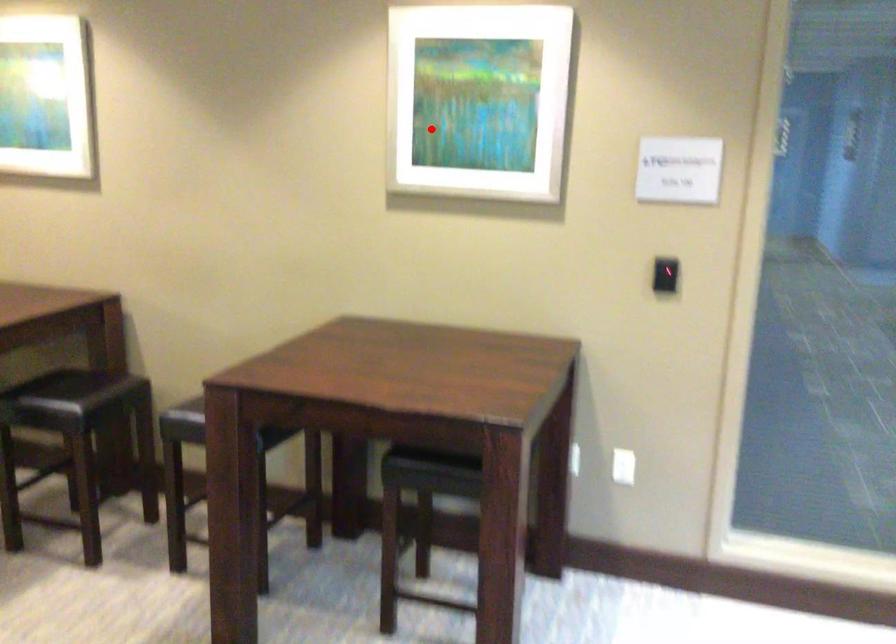
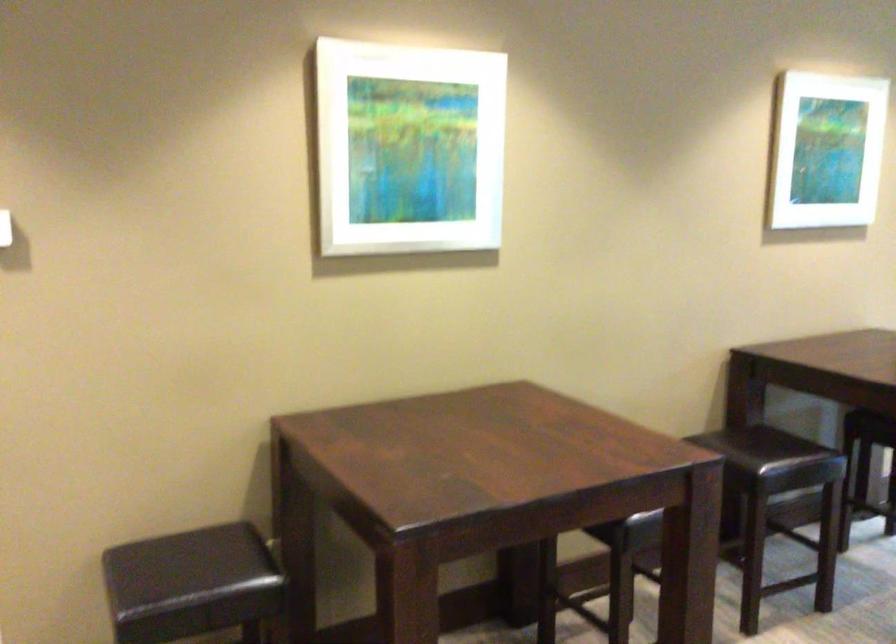
The point at the highlighted location is marked in the first image. Where is the corresponding point in the second image?

(824, 149)